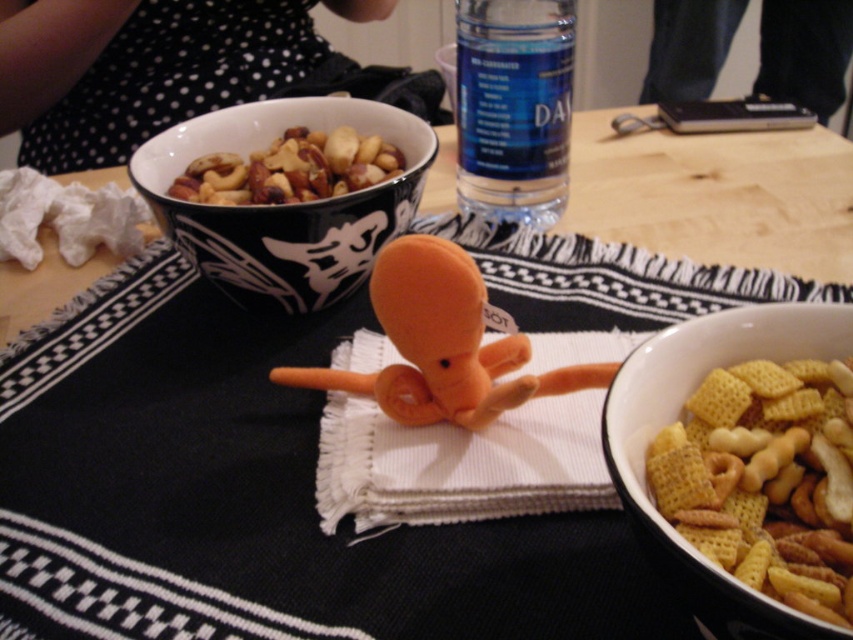
Question: Which point is farther to the camera?

Choices:
 (A) (485, 278)
 (B) (444, 342)
 (C) (549, 45)

Answer: (C)

Question: Which point is farther from the camera taking this photo?

Choices:
 (A) (247, 195)
 (B) (425, 248)

Answer: (A)

Question: Can you confirm if orange plush octopus at center is positioned to the left of shiny brown nuts at upper center?

Choices:
 (A) no
 (B) yes

Answer: (A)

Question: Is matte white bowl at lower right above blue plastic bottle at upper center?

Choices:
 (A) no
 (B) yes

Answer: (A)

Question: Can you confirm if blue plastic bottle at upper center is smaller than shiny brown nuts at upper center?

Choices:
 (A) yes
 (B) no

Answer: (B)

Question: Which object is closer to the camera taking this photo?

Choices:
 (A) matte white bowl at lower right
 (B) orange plush octopus at center
 (C) shiny brown nuts at upper center
 (D) white woven cloth at center

Answer: (A)